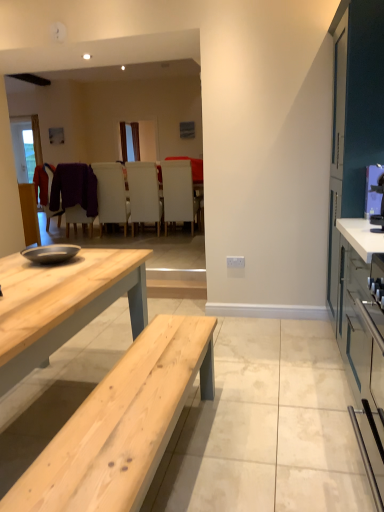
Question: Is white leather chair at center, the second chair when ordered from left to right, taller or shorter than matte gray cabinet at right?

Choices:
 (A) tall
 (B) short

Answer: (A)

Question: Is white leather chair at center, the second chair when ordered from left to right, in front of or behind matte gray cabinet at right in the image?

Choices:
 (A) front
 (B) behind

Answer: (B)

Question: Considering the real-world distances, which object is farthest from the white matte chair at center, the 4th chair from the left?

Choices:
 (A) metallic blue microwave at right
 (B) purple fuzzy sweater at center
 (C) matte gray cabinet at right
 (D) matte black chair at center, which appears as the 4th chair when viewed from the right
 (E) natural wood table at center

Answer: (E)

Question: Which is farther from the white leather chair at center, positioned as the third chair in right-to-left order?

Choices:
 (A) matte black chair at center, the 1th chair in the left-to-right sequence
 (B) metallic blue microwave at right
 (C) natural wood table at center
 (D) white matte chair at center, the 4th chair from the left
 (E) purple fuzzy sweater at center

Answer: (C)